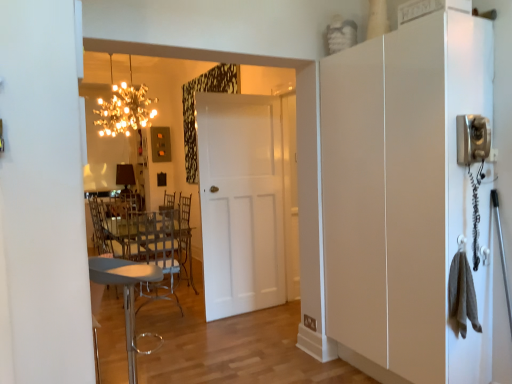
Question: Considering the positions of point (126, 225) and point (112, 74), is point (126, 225) closer or farther from the camera than point (112, 74)?

Choices:
 (A) farther
 (B) closer

Answer: (B)

Question: Is clear plastic chair at center, which is the 1th chair in back-to-front order, taller or shorter than sparkling crystal chandelier at upper center?

Choices:
 (A) short
 (B) tall

Answer: (B)

Question: Estimate the real-world distances between objects in this image. Which object is closer to the sparkling crystal chandelier at upper center?

Choices:
 (A) clear plastic chair at center, which is the 2th chair from front to back
 (B) white matte cabinet at right
 (C) metallic gray stool at lower left, which ranks as the 1th chair in front-to-back order
 (D) white matte door at center

Answer: (A)

Question: Estimate the real-world distances between objects in this image. Which object is closer to the sparkling crystal chandelier at upper center?

Choices:
 (A) white matte door at center
 (B) clear plastic chair at center, which is the 2th chair from front to back
 (C) metallic gray stool at lower left, which ranks as the 1th chair in front-to-back order
 (D) white matte cabinet at right

Answer: (B)